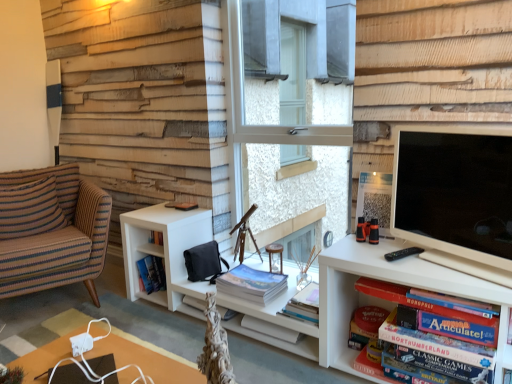
Locate an element on the screen. free space below matte white tv at right (from a real-world perspective) is located at coordinates (453, 264).